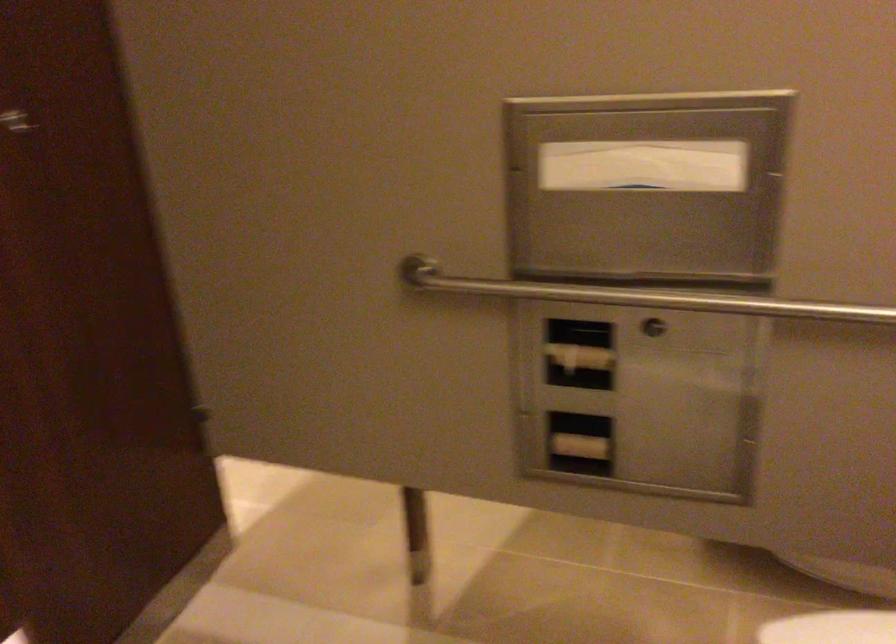
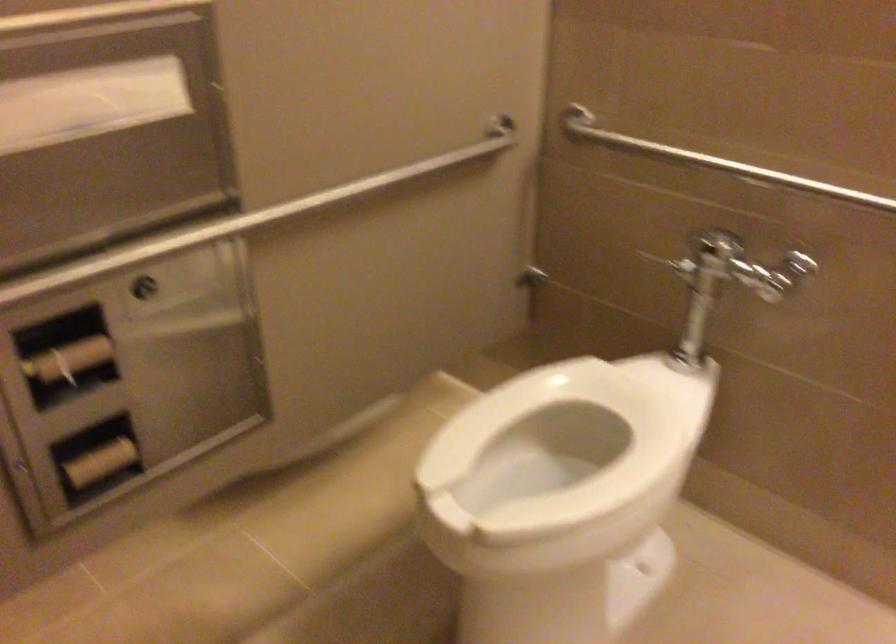
The point at (742, 301) is marked in the first image. Where is the corresponding point in the second image?

(246, 220)